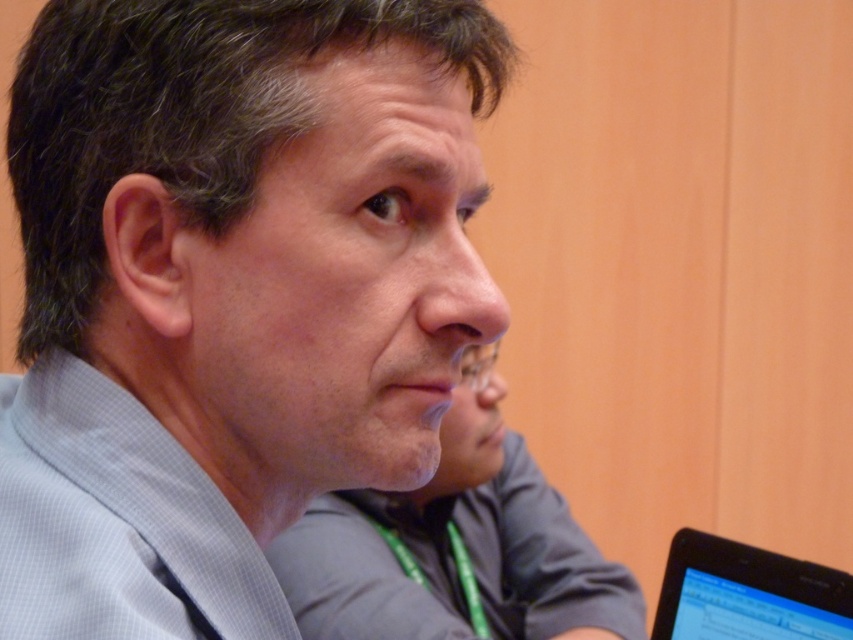
Looking at this image, is the position of light blue checkered dress shirt at center less distant than that of matte gray shirt at center?

Yes, it is.

Find the location of a particular element. Image resolution: width=853 pixels, height=640 pixels. light blue checkered dress shirt at center is located at coordinates (115, 522).

Who is positioned more to the left, gray checkered shirt at center or light blue checkered dress shirt at center?

light blue checkered dress shirt at center is more to the left.

Who is more distant from viewer, (22, 573) or (51, 385)?

Positioned behind is point (51, 385).

Between point (450, 38) and point (76, 480), which one is positioned behind?

Point (450, 38)

You are a GUI agent. You are given a task and a screenshot of the screen. Output one action in this format:
    pyautogui.click(x=<x>, y=<y>)
    Task: Click on the gray checkered shirt at center
    
    Given the screenshot: What is the action you would take?
    pyautogui.click(x=258, y=225)

Consider the image. Can you confirm if matte gray shirt at center is taller than black glossy tablet at lower right?

Correct, matte gray shirt at center is much taller as black glossy tablet at lower right.

Can you confirm if matte gray shirt at center is positioned below black glossy tablet at lower right?

Correct, matte gray shirt at center is located below black glossy tablet at lower right.

Where is `matte gray shirt at center`? matte gray shirt at center is located at coordinates (456, 547).

This screenshot has width=853, height=640. Identify the location of matte gray shirt at center. point(456,547).